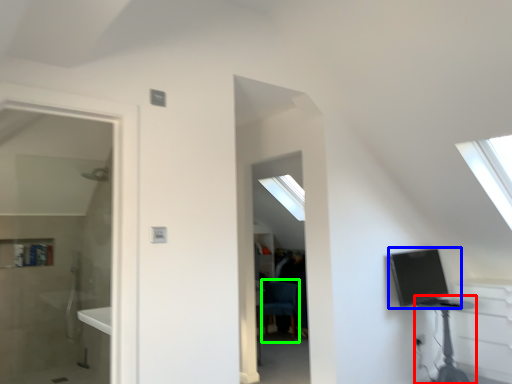
Question: Estimate the real-world distances between objects in this image. Which object is farther from table (highlighted by a red box), computer (highlighted by a blue box) or swivel chair (highlighted by a green box)?

Choices:
 (A) computer
 (B) swivel chair

Answer: (B)